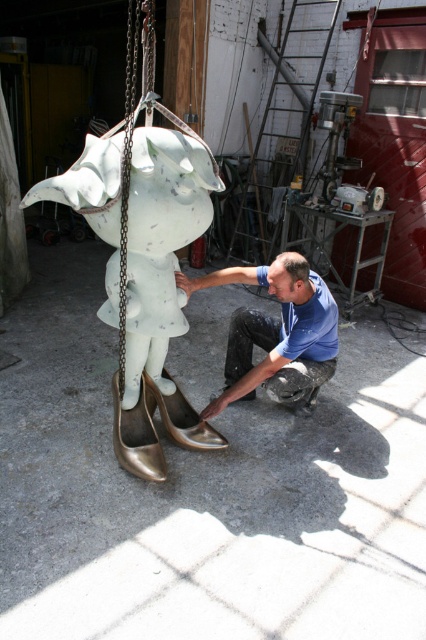
Question: Which point is farther to the camera?

Choices:
 (A) white glossy statue at center
 (B) metallic chain at center
 (C) blue matte shirt at lower center

Answer: (B)

Question: Considering the real-world distances, which object is closest to the white glossy statue at center?

Choices:
 (A) shiny gold shoe at lower center
 (B) blue matte shirt at lower center
 (C) gold metallic shoe at lower left
 (D) metallic chain at center

Answer: (B)

Question: Can you confirm if white glossy statue at center is positioned to the right of gold metallic shoe at lower left?

Choices:
 (A) no
 (B) yes

Answer: (A)

Question: Does white glossy statue at center have a greater width compared to metallic chain at center?

Choices:
 (A) yes
 (B) no

Answer: (A)

Question: Which point is closer to the camera?

Choices:
 (A) white glossy statue at center
 (B) metallic chain at center
 (C) gold shiny shoe at lower left
 (D) gold metallic shoe at lower left

Answer: (A)

Question: Is metallic chain at center thinner than gold shiny shoe at lower left?

Choices:
 (A) no
 (B) yes

Answer: (B)